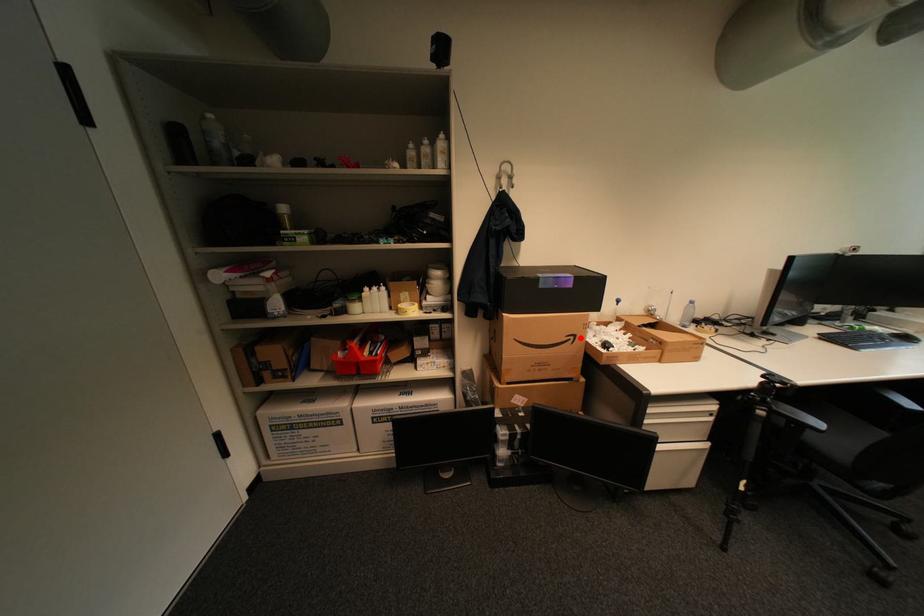
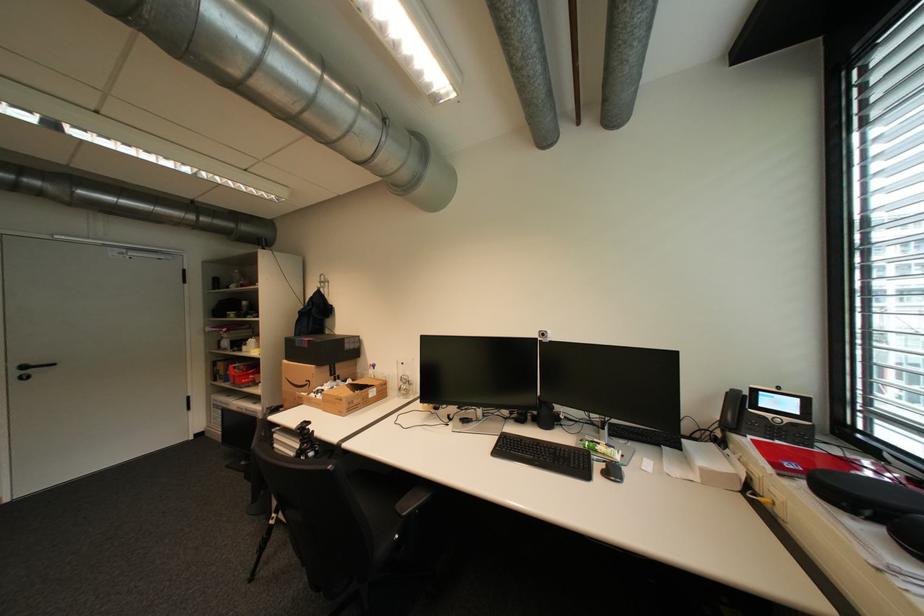
Question: I am providing you with two images of the same scene from different viewpoints. In image1, a red point is highlighted. Considering the same 3D point in image2, which of the following is correct?

Choices:
 (A) It is closer
 (B) It is farther

Answer: (B)